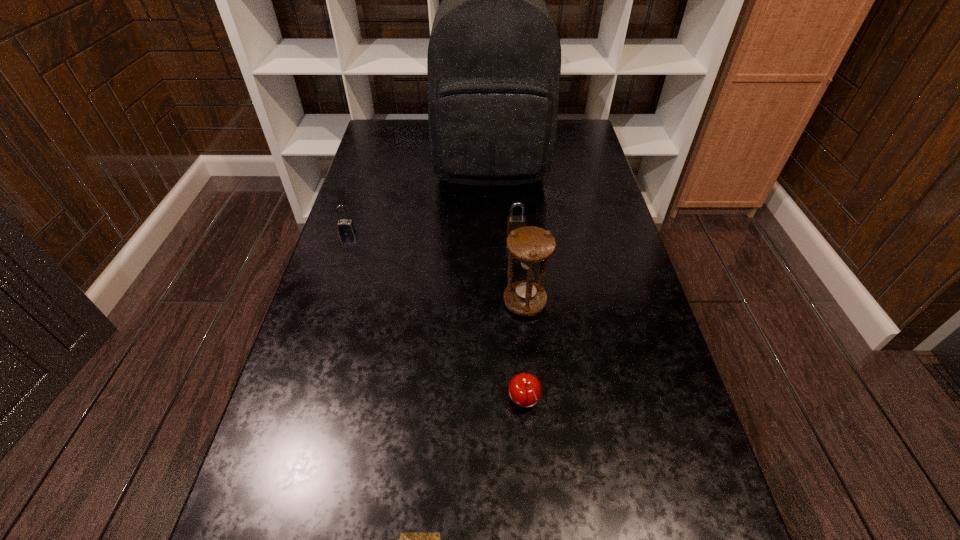
Where is `the tallest object`? the tallest object is located at coordinates (494, 56).

In order to click on the farthest object in this screenshot , I will do `click(494, 56)`.

Locate an element on the screen. the third nearest object is located at coordinates (531, 246).

Identify the location of hourglass. The height and width of the screenshot is (540, 960). (531, 246).

Locate an element on the screen. The image size is (960, 540). the rightmost padlock is located at coordinates (513, 221).

Where is `the leftmost padlock`? the leftmost padlock is located at coordinates (346, 227).

Find the location of a particular element. The image size is (960, 540). the second nearest object is located at coordinates (525, 390).

The width and height of the screenshot is (960, 540). Identify the location of cherry. (525, 390).

This screenshot has height=540, width=960. I want to click on vacant space located 0.280m on the front-facing side of the tallest object, so coord(493,258).

This screenshot has width=960, height=540. Identify the location of free space located on the left of the fifth shortest object. [428, 302].